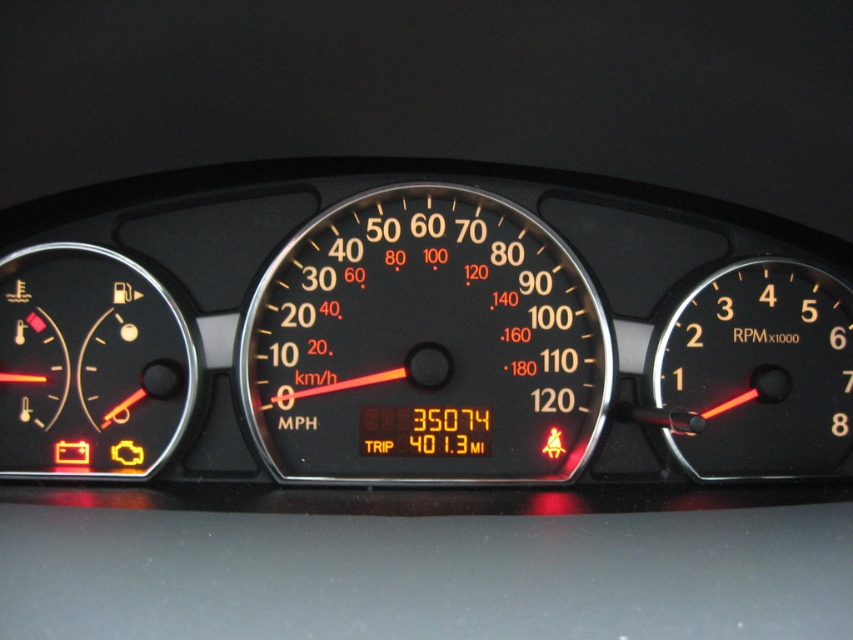
You are a mechanic inspecting a car dashboard. You notice two speedometers, the black plastic speedometer at center and the matte black speedometer at left. Which one has a bigger display?

The black plastic speedometer at center has a bigger display than the matte black speedometer at left.

You are driving a car and want to check both the black plastic speedometer at center and the black plastic rpm gauge at right. Which one is located to the left of the other?

The black plastic speedometer at center is positioned on the left side of black plastic rpm gauge at right.

You are a mechanic inspecting a car dashboard. You need to determine if there is enough space between the black plastic speedometer at center and the black plastic rpm gauge at right to install a new GPS device. The GPS device requires a width of 12 inches. Can you fit it between them?

The black plastic speedometer at center is wider than the black plastic rpm gauge at right. However, the exact distance between them isn not specified in the description. Therefore, it is uncertain whether the GPS device requiring 12 inches can be installed between them.